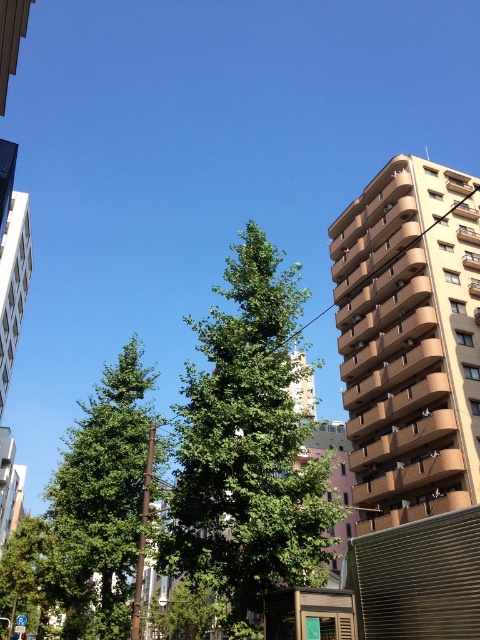
Is green leafy tree at center bigger than green leafy tree at left?

Actually, green leafy tree at center might be smaller than green leafy tree at left.

Does green leafy tree at center appear over green leafy tree at left?

Indeed, green leafy tree at center is positioned over green leafy tree at left.

Measure the distance between point (204, 372) and camera.

Point (204, 372) is 18.07 meters from camera.

This screenshot has height=640, width=480. Find the location of `green leafy tree at center`. green leafy tree at center is located at coordinates (247, 449).